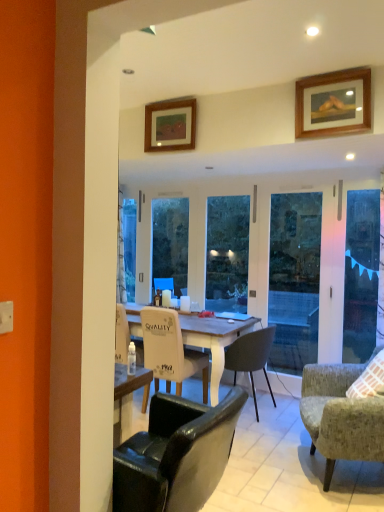
Question: Is matte white coffee cup at center, which is the third coffee cup in left-to-right order, closer to the viewer compared to textured gray armchair at lower right, the second chair positioned from the front?

Choices:
 (A) no
 (B) yes

Answer: (A)

Question: Is matte white coffee cup at center, which is the third coffee cup in left-to-right order, thinner than textured gray armchair at lower right, placed as the third chair when sorted from back to front?

Choices:
 (A) yes
 (B) no

Answer: (A)

Question: Is textured gray armchair at lower right, placed as the third chair when sorted from back to front, at the back of matte white coffee cup at center, arranged as the 1th coffee cup when viewed from the right?

Choices:
 (A) yes
 (B) no

Answer: (B)

Question: Is matte white coffee cup at center, which is the third coffee cup in left-to-right order, to the right of textured gray armchair at lower right, the second chair positioned from the front, from the viewer's perspective?

Choices:
 (A) no
 (B) yes

Answer: (A)

Question: Could you tell me if matte white coffee cup at center, which is the third coffee cup in left-to-right order, is facing textured gray armchair at lower right, placed as the third chair when sorted from back to front?

Choices:
 (A) no
 (B) yes

Answer: (A)

Question: Considering the relative sizes of matte white coffee cup at center, which is the third coffee cup in left-to-right order, and textured gray armchair at lower right, the second chair positioned from the front, in the image provided, is matte white coffee cup at center, which is the third coffee cup in left-to-right order, bigger than textured gray armchair at lower right, the second chair positioned from the front,?

Choices:
 (A) yes
 (B) no

Answer: (B)

Question: Is textured gray armchair at lower right, placed as the third chair when sorted from back to front, shorter than wooden picture frame at upper right, the 1th picture frame viewed from the front?

Choices:
 (A) yes
 (B) no

Answer: (B)

Question: Is textured gray armchair at lower right, the second chair positioned from the front, closer to the viewer compared to wooden picture frame at upper right, the 1th picture frame viewed from the front?

Choices:
 (A) yes
 (B) no

Answer: (A)

Question: Is textured gray armchair at lower right, the second chair positioned from the front, looking in the opposite direction of wooden picture frame at upper right, the 1th picture frame viewed from the front?

Choices:
 (A) yes
 (B) no

Answer: (B)

Question: From a real-world perspective, is textured gray armchair at lower right, the second chair positioned from the front, physically below wooden picture frame at upper right, the first picture frame when ordered from right to left?

Choices:
 (A) no
 (B) yes

Answer: (B)

Question: Is textured gray armchair at lower right, the second chair positioned from the front, at the right side of wooden picture frame at upper right, which appears as the 2th picture frame when viewed from the left?

Choices:
 (A) no
 (B) yes

Answer: (B)

Question: Would you say wooden picture frame at upper right, acting as the 2th picture frame starting from the back, is part of textured gray armchair at lower right, the second chair positioned from the front,'s contents?

Choices:
 (A) yes
 (B) no

Answer: (B)

Question: Can you confirm if white glossy coffee cup at center, which is the first coffee cup in left-to-right order, is thinner than transparent glass screen door at right?

Choices:
 (A) no
 (B) yes

Answer: (A)